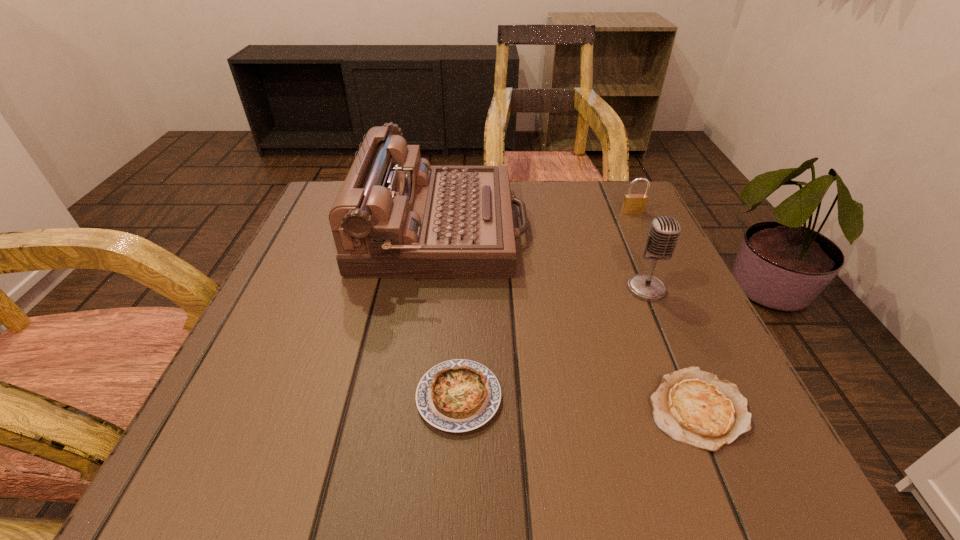
Where is `blank space located 0.150m on the right of the left quiche`? blank space located 0.150m on the right of the left quiche is located at coordinates (604, 397).

Identify the location of free point located 0.190m on the left of the right quiche. Image resolution: width=960 pixels, height=540 pixels. (516, 408).

Locate an element on the screen. The height and width of the screenshot is (540, 960). typewriter that is at the far edge is located at coordinates (395, 216).

At what (x,y) coordinates should I click in order to perform the action: click on padlock that is at the far edge. Please return your answer as a coordinate pair (x, y). Looking at the image, I should click on point(633,203).

Identify the location of object at the left edge. Image resolution: width=960 pixels, height=540 pixels. (395, 216).

Find the location of a particular element. The height and width of the screenshot is (540, 960). microphone that is positioned at the right edge is located at coordinates (664, 232).

Identify the location of padlock that is at the right edge. (633, 203).

Where is `quiche that is at the right edge`? The image size is (960, 540). quiche that is at the right edge is located at coordinates pos(692,406).

This screenshot has height=540, width=960. Find the location of `object at the far left corner`. object at the far left corner is located at coordinates (395, 216).

Where is `object that is at the far right corner`? object that is at the far right corner is located at coordinates (633, 203).